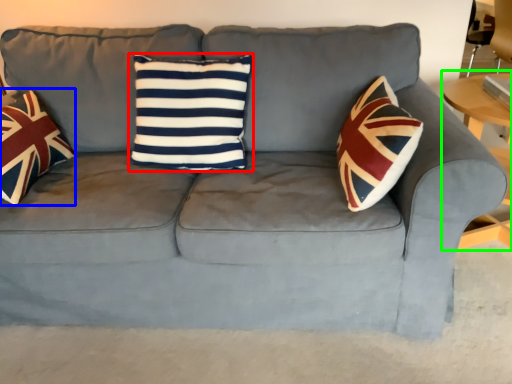
Question: Estimate the real-world distances between objects in this image. Which object is farther from pillow (highlighted by a red box), throw pillow (highlighted by a blue box) or table (highlighted by a green box)?

Choices:
 (A) throw pillow
 (B) table

Answer: (B)